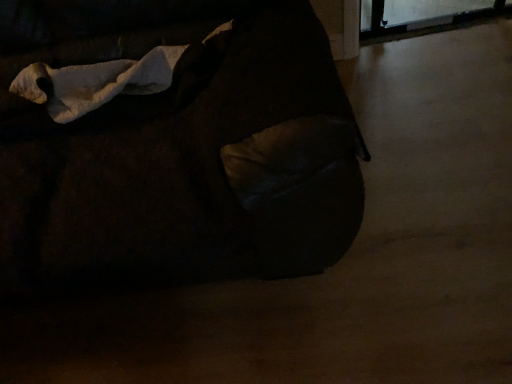
Describe the element at coordinates (177, 151) in the screenshot. I see `dark fabric bean bag at center` at that location.

Find the location of a particular element. dark fabric bean bag at center is located at coordinates (177, 151).

In order to click on dark fabric bean bag at center in this screenshot , I will do `click(177, 151)`.